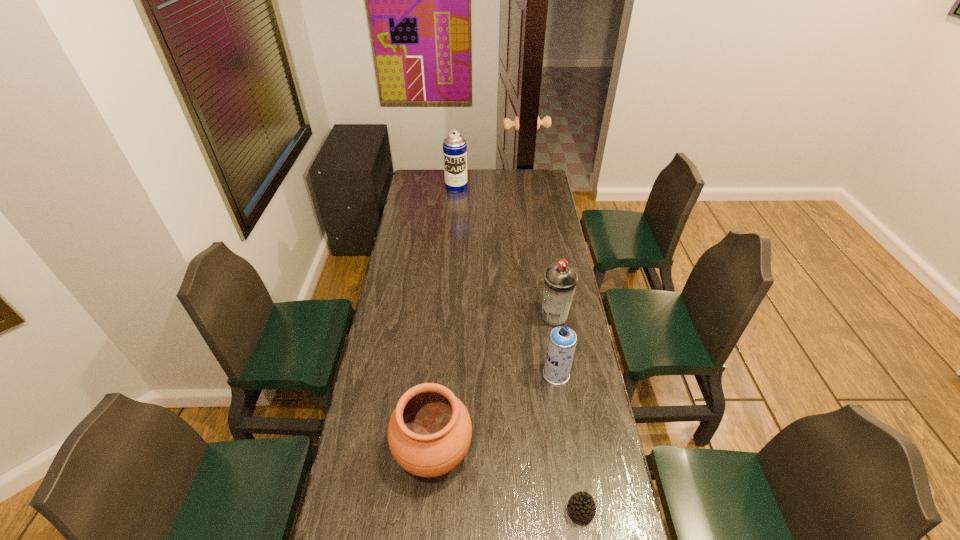
Find the location of a particular element. free space at the left edge is located at coordinates click(x=430, y=197).

You are a GUI agent. You are given a task and a screenshot of the screen. Output one action in this format:
    pyautogui.click(x=<x>, y=<y>)
    Task: Click on the vacant space at the right edge of the desktop
    The height and width of the screenshot is (540, 960).
    Given the screenshot: What is the action you would take?
    pyautogui.click(x=551, y=391)

Identify the location of vacant space at the far left corner. The image size is (960, 540). (424, 170).

Find the location of a particular element. Image resolution: width=960 pixels, height=540 pixels. vacant region between the pinecone and the shortest aerosol can is located at coordinates (568, 442).

Identify the location of vacant space that is in between the shortest object and the nearest aerosol can. This screenshot has height=540, width=960. (568, 442).

Identify the location of vacant area that lies between the pottery and the shortest object. This screenshot has height=540, width=960. pos(507,481).

Find the location of a particular element. empty space that is in between the shortest aerosol can and the nearest object is located at coordinates (568, 442).

In order to click on unoccupied position between the farthest aerosol can and the pottery in this screenshot , I will do `click(444, 320)`.

Identify the location of free space between the leftmost aerosol can and the pinecone. 518,349.

At what (x,y) coordinates should I click in order to perform the action: click on free space between the second farthest aerosol can and the farthest object. Please return your answer as a coordinate pair (x, y). Looking at the image, I should click on (505, 252).